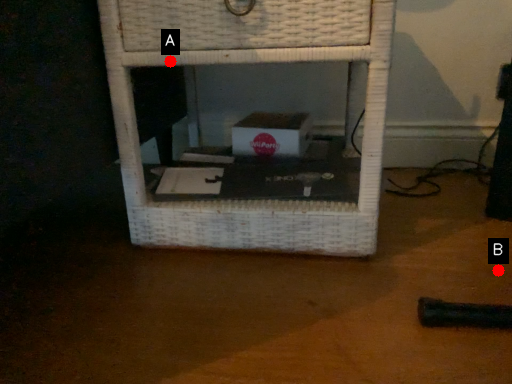
Question: Two points are circled on the image, labeled by A and B beside each circle. Which point appears farthest from the camera in this image?

Choices:
 (A) A is further
 (B) B is further

Answer: (B)